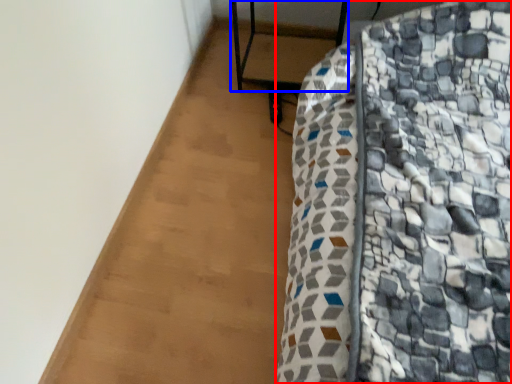
Question: Which point is closer to the camera, furniture (highlighted by a red box) or furniture (highlighted by a blue box)?

Choices:
 (A) furniture
 (B) furniture

Answer: (A)